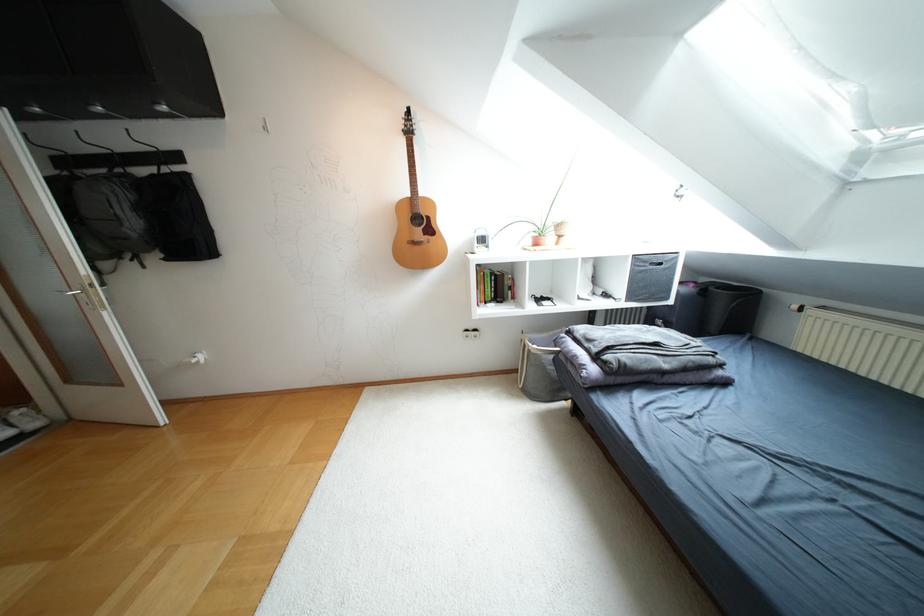
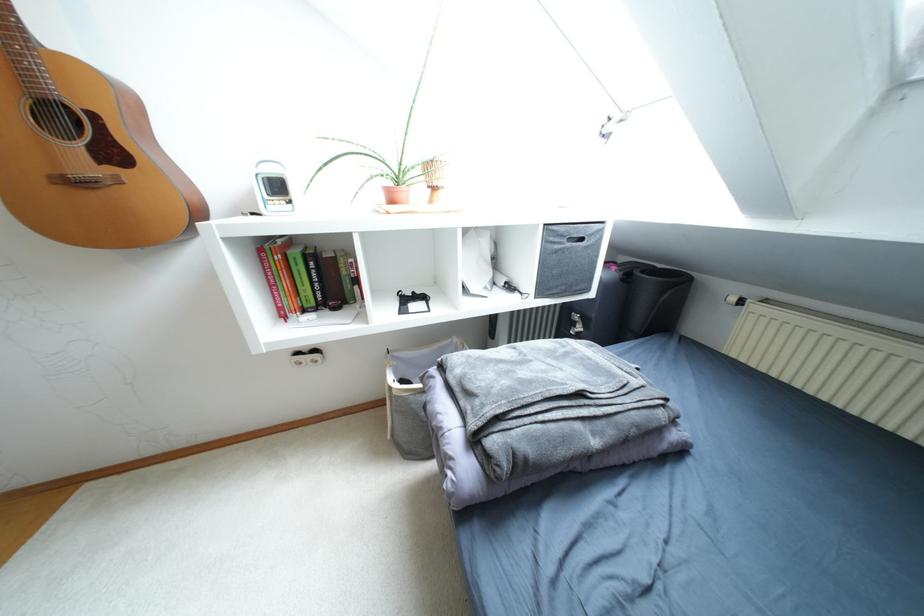
Looking at this image, the images are taken continuously from a first-person perspective. In which direction are you moving?

The cameraman walked toward right, forward.